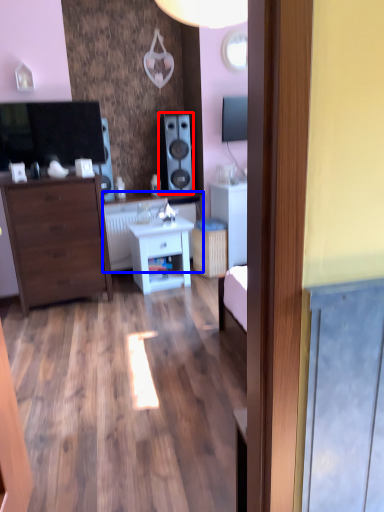
Question: Among these objects, which one is farthest to the camera, speaker (highlighted by a red box) or counter top (highlighted by a blue box)?

Choices:
 (A) speaker
 (B) counter top

Answer: (A)